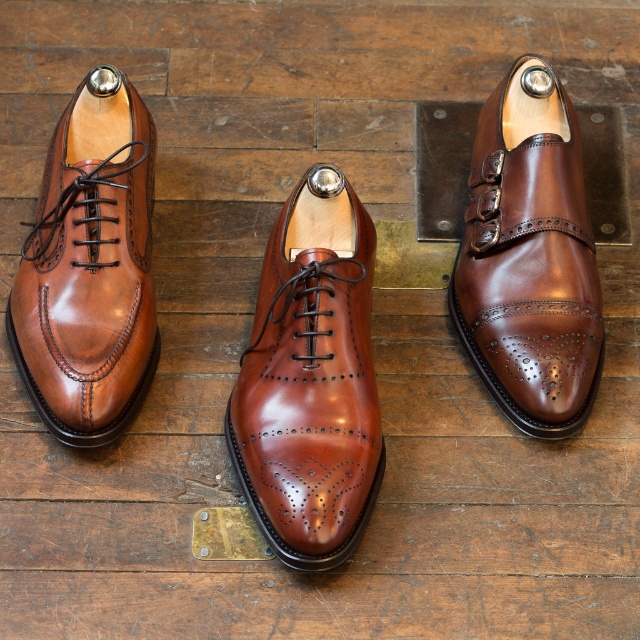
Who is shorter, shiny brown leather shoe at upper center or matte brown leather shoe at left?

With less height is matte brown leather shoe at left.

Where is `shiny brown leather shoe at upper center`? shiny brown leather shoe at upper center is located at coordinates (529, 259).

In the scene shown: Measure the distance between point (490, 246) and camera.

Point (490, 246) is 4.21 feet from camera.

Locate an element on the screen. The image size is (640, 640). shiny brown leather shoe at upper center is located at coordinates point(529,259).

Does shiny brown leather shoe at center have a greater width compared to matte brown leather shoe at left?

Yes.

Is shiny brown leather shoe at center taller than matte brown leather shoe at left?

Indeed, shiny brown leather shoe at center has a greater height compared to matte brown leather shoe at left.

Is point (268, 458) in front of point (68, 344)?

Yes, it is.

Find the location of a particular element. The height and width of the screenshot is (640, 640). shiny brown leather shoe at center is located at coordinates (310, 380).

Is shiny brown leather shoe at center to the right of shiny brown leather shoe at upper center from the viewer's perspective?

In fact, shiny brown leather shoe at center is to the left of shiny brown leather shoe at upper center.

Does shiny brown leather shoe at center appear under shiny brown leather shoe at upper center?

Indeed, shiny brown leather shoe at center is positioned under shiny brown leather shoe at upper center.

Is point (294, 237) positioned behind point (506, 188)?

No, (294, 237) is in front of (506, 188).

At what (x,y) coordinates should I click in order to perform the action: click on shiny brown leather shoe at center. Please return your answer as a coordinate pair (x, y). This screenshot has width=640, height=640. Looking at the image, I should click on (310, 380).